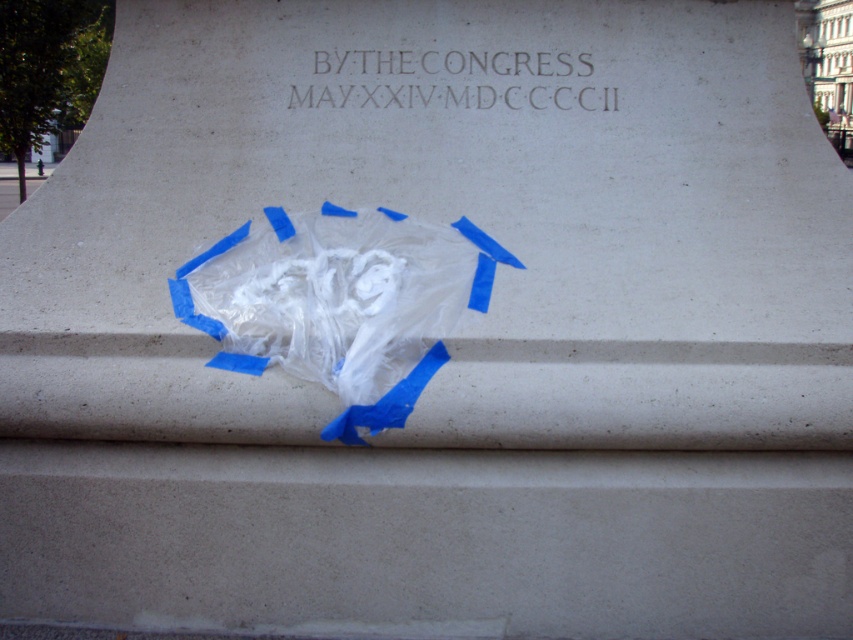
Question: Which object is closer to the camera taking this photo?

Choices:
 (A) translucent plastic bag at center
 (B) dark gray stone inscription at upper center

Answer: (A)

Question: Can you confirm if translucent plastic bag at center is bigger than dark gray stone inscription at upper center?

Choices:
 (A) yes
 (B) no

Answer: (A)

Question: Can you confirm if translucent plastic bag at center is wider than dark gray stone inscription at upper center?

Choices:
 (A) no
 (B) yes

Answer: (A)

Question: Among these objects, which one is nearest to the camera?

Choices:
 (A) translucent plastic bag at center
 (B) dark gray stone inscription at upper center

Answer: (A)

Question: Which of the following is the closest to the observer?

Choices:
 (A) tap(485, 60)
 (B) tap(357, 436)

Answer: (B)

Question: Does translucent plastic bag at center have a smaller size compared to dark gray stone inscription at upper center?

Choices:
 (A) no
 (B) yes

Answer: (A)